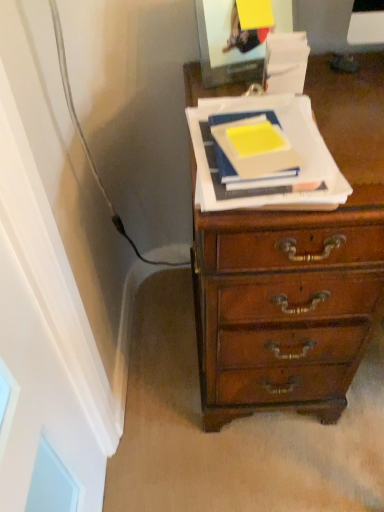
The image size is (384, 512). Identify the location of free spot above yellow matte paper at center, placed as the first paperback book when sorted from right to left (from a real-world perspective). pyautogui.click(x=260, y=138).